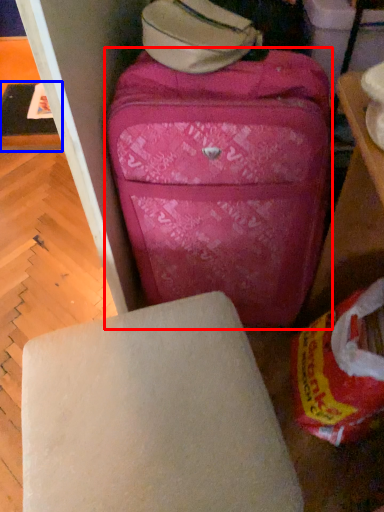
Question: Among these objects, which one is nearest to the camera, suitcase (highlighted by a red box) or table (highlighted by a blue box)?

Choices:
 (A) suitcase
 (B) table

Answer: (A)